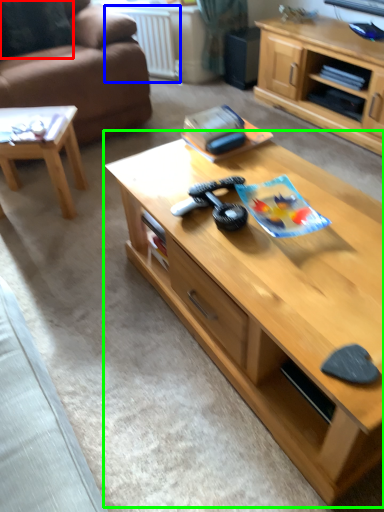
Question: Based on their relative distances, which object is nearer to pillow (highlighted by a red box)? Choose from radiator (highlighted by a blue box) and coffee table (highlighted by a green box).

Choices:
 (A) radiator
 (B) coffee table

Answer: (A)